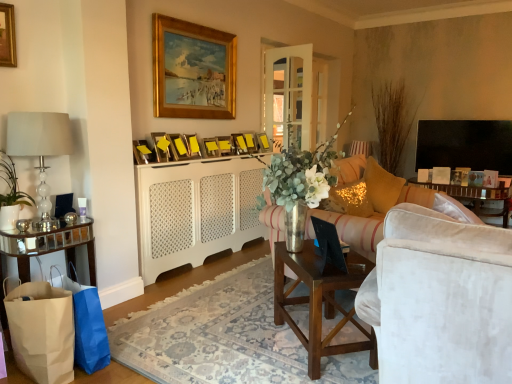
Question: Can you confirm if yellow matte picture frame at center, placed as the 4th picture frame when sorted from left to right, is positioned to the right of white textured dresser at center?

Choices:
 (A) yes
 (B) no

Answer: (B)

Question: Is yellow matte picture frame at center, placed as the eighth picture frame when sorted from right to left, taller than white textured dresser at center?

Choices:
 (A) yes
 (B) no

Answer: (B)

Question: From a real-world perspective, is yellow matte picture frame at center, placed as the 4th picture frame when sorted from left to right, on white textured dresser at center?

Choices:
 (A) yes
 (B) no

Answer: (A)

Question: Can you confirm if yellow matte picture frame at center, placed as the eighth picture frame when sorted from right to left, is bigger than white textured dresser at center?

Choices:
 (A) yes
 (B) no

Answer: (B)

Question: From a real-world perspective, is yellow matte picture frame at center, placed as the eighth picture frame when sorted from right to left, physically below white textured dresser at center?

Choices:
 (A) yes
 (B) no

Answer: (B)

Question: Is yellow matte picture frame at center, placed as the 4th picture frame when sorted from left to right, not close to white textured dresser at center?

Choices:
 (A) no
 (B) yes

Answer: (A)

Question: Can you confirm if white paper bag at lower left, the 1th shopping bag in the back-to-front sequence, is taller than gold-framed painting at upper center, the sixth picture frame positioned from the left?

Choices:
 (A) no
 (B) yes

Answer: (A)

Question: From the image's perspective, is white paper bag at lower left, placed as the 2th shopping bag when sorted from front to back, over gold-framed painting at upper center, acting as the 6th picture frame starting from the right?

Choices:
 (A) no
 (B) yes

Answer: (A)

Question: Does white paper bag at lower left, placed as the 2th shopping bag when sorted from front to back, have a lesser width compared to gold-framed painting at upper center, acting as the 6th picture frame starting from the right?

Choices:
 (A) no
 (B) yes

Answer: (A)

Question: Is white paper bag at lower left, the 1th shopping bag in the back-to-front sequence, to the left of gold-framed painting at upper center, acting as the 6th picture frame starting from the right, from the viewer's perspective?

Choices:
 (A) yes
 (B) no

Answer: (A)

Question: From the image's perspective, is white paper bag at lower left, placed as the 2th shopping bag when sorted from front to back, beneath gold-framed painting at upper center, acting as the 6th picture frame starting from the right?

Choices:
 (A) yes
 (B) no

Answer: (A)

Question: From a real-world perspective, is white paper bag at lower left, placed as the 2th shopping bag when sorted from front to back, positioned over gold-framed painting at upper center, acting as the 6th picture frame starting from the right, based on gravity?

Choices:
 (A) yes
 (B) no

Answer: (B)

Question: Considering the relative sizes of clear glass lamp at left, the 2th lamp viewed from the top, and yellow matte picture frame at center, marked as the eighth picture frame in a left-to-right arrangement, in the image provided, is clear glass lamp at left, the 2th lamp viewed from the top, thinner than yellow matte picture frame at center, marked as the eighth picture frame in a left-to-right arrangement,?

Choices:
 (A) yes
 (B) no

Answer: (B)